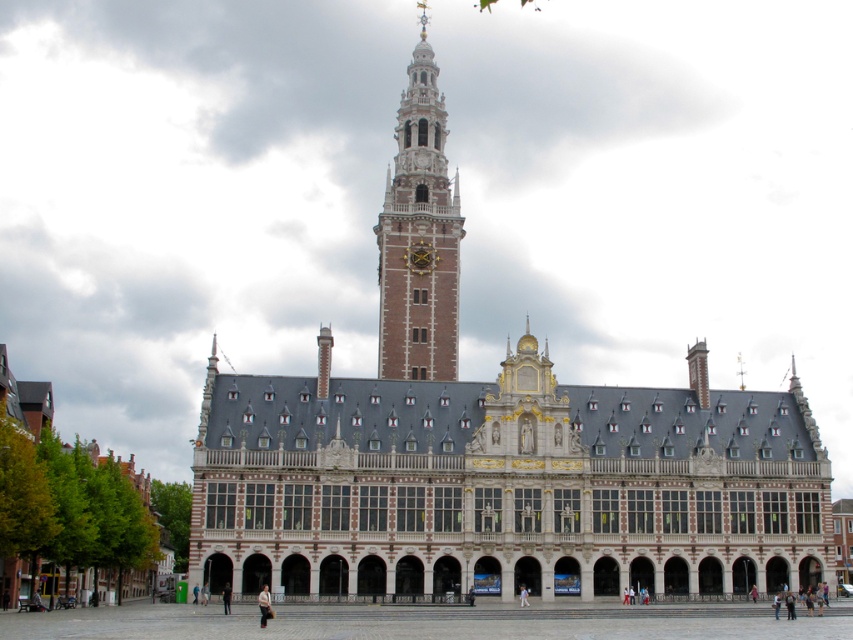
Can you confirm if brick stone building at center is smaller than white stone building at center?

Incorrect, brick stone building at center is not smaller in size than white stone building at center.

Who is positioned more to the right, brick stone building at center or white stone building at center?

From the viewer's perspective, brick stone building at center appears more on the right side.

Between point (450, 385) and point (199, 474), which one is positioned in front?

Positioned in front is point (199, 474).

Locate an element on the screen. brick stone building at center is located at coordinates (x=492, y=449).

Consider the image. Can you confirm if brown brick tower at center is taller than dark gray fabric jacket at lower center?

Indeed, brown brick tower at center has a greater height compared to dark gray fabric jacket at lower center.

Is brown brick tower at center smaller than dark gray fabric jacket at lower center?

No, brown brick tower at center is not smaller than dark gray fabric jacket at lower center.

Describe the element at coordinates (419, 236) in the screenshot. I see `brown brick tower at center` at that location.

Where is `brown brick tower at center`? This screenshot has height=640, width=853. brown brick tower at center is located at coordinates (419, 236).

Measure the distance between brick stone building at center and brown brick tower at center.

brick stone building at center and brown brick tower at center are 33.63 feet apart.

Which is below, brick stone building at center or brown brick tower at center?

brick stone building at center is below.

Between point (343, 472) and point (424, 298), which one is positioned behind?

The point (424, 298) is behind.

In order to click on brick stone building at center in this screenshot , I will do click(x=492, y=449).